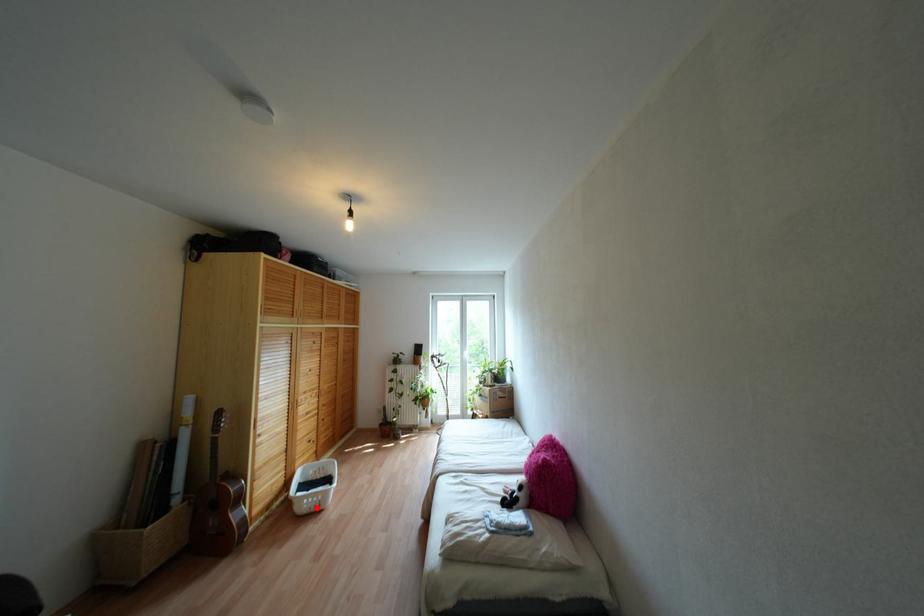
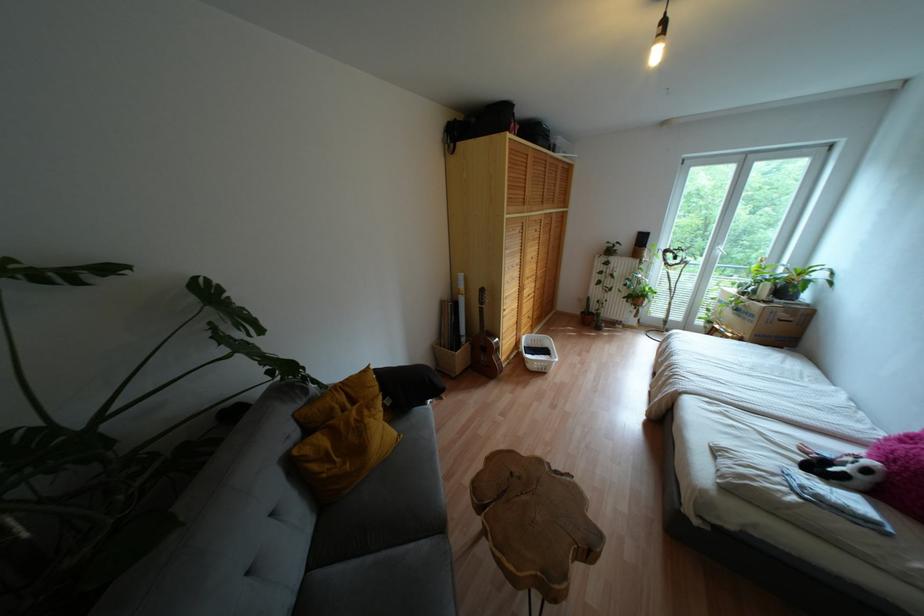
Question: A red point is marked in image1. In image2, is the corresponding 3D point closer to the camera or farther? Reply with the corresponding letter.

Choices:
 (A) The corresponding 3D point is closer.
 (B) The corresponding 3D point is farther.

Answer: (A)